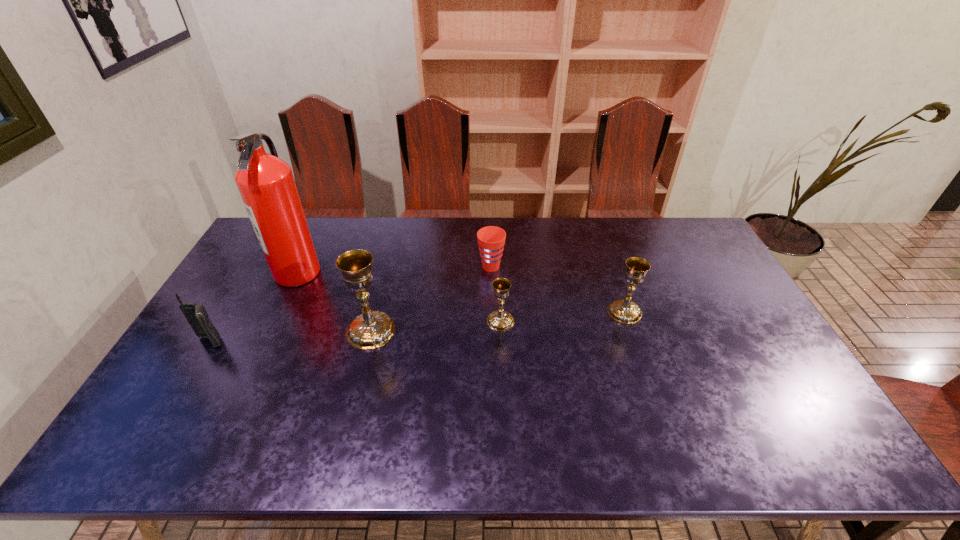
Please point a free position for a chalice on the right. Please provide its 2D coordinates. Your answer should be formatted as a tuple, i.e. [(x, y)], where the tuple contains the x and y coordinates of a point satisfying the conditions above.

[(744, 303)]